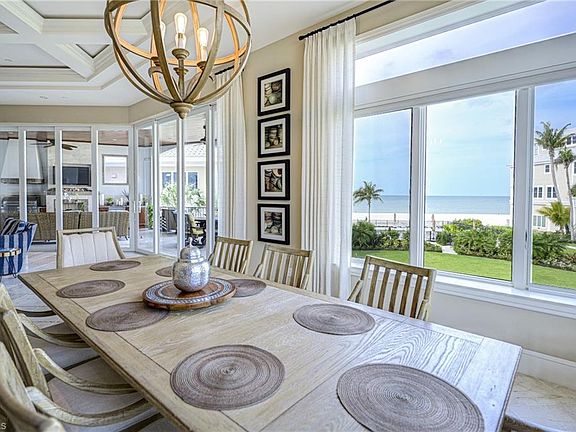
What are the coordinates of `window` in the screenshot? It's located at (126, 174).